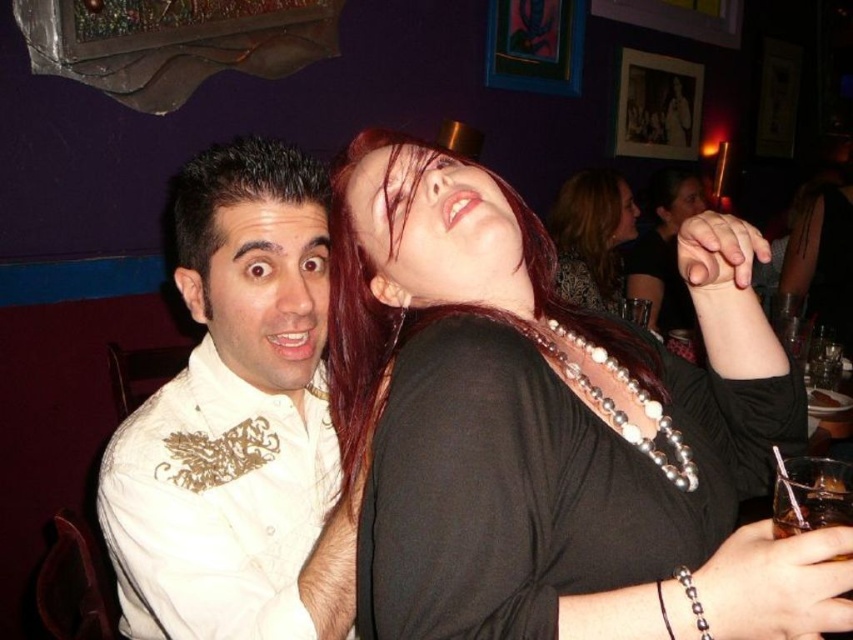
Consider the image. Does shiny black necklace at upper center appear over pearl beaded necklace at upper center?

Correct, shiny black necklace at upper center is located above pearl beaded necklace at upper center.

Is shiny black necklace at upper center shorter than pearl beaded necklace at upper center?

Incorrect, shiny black necklace at upper center's height does not fall short of pearl beaded necklace at upper center's.

Is point (570, 264) less distant than point (547, 332)?

No, (570, 264) is further to viewer.

The width and height of the screenshot is (853, 640). I want to click on shiny black necklace at upper center, so click(592, 236).

Is point (332, 520) in front of point (578, 269)?

That is True.

Which is in front, point (236, 406) or point (630, 234)?

Positioned in front is point (236, 406).

The image size is (853, 640). Identify the location of white embroidered shirt at left. (236, 420).

Does black pearl necklace at upper right have a smaller size compared to shiny black necklace at upper center?

Yes.

Who is higher up, black pearl necklace at upper right or shiny black necklace at upper center?

shiny black necklace at upper center is higher up.

You are a GUI agent. You are given a task and a screenshot of the screen. Output one action in this format:
    pyautogui.click(x=<x>, y=<y>)
    Task: Click on the black pearl necklace at upper right
    
    Given the screenshot: What is the action you would take?
    [553, 428]

In order to click on black pearl necklace at upper right in this screenshot , I will do `click(553, 428)`.